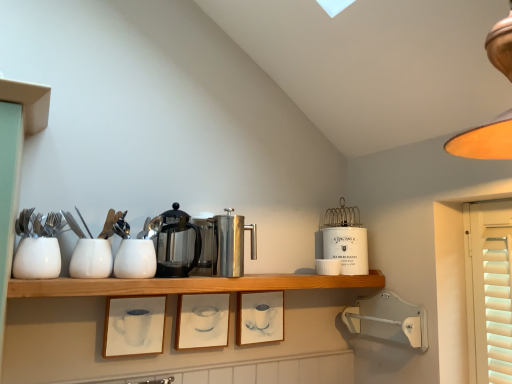
The image size is (512, 384). I want to click on free space between polished stainless steel coffee press at center, acting as the second appliance starting from the right, and white ceramic cup at upper right, which is the first tableware from back to front, so click(283, 277).